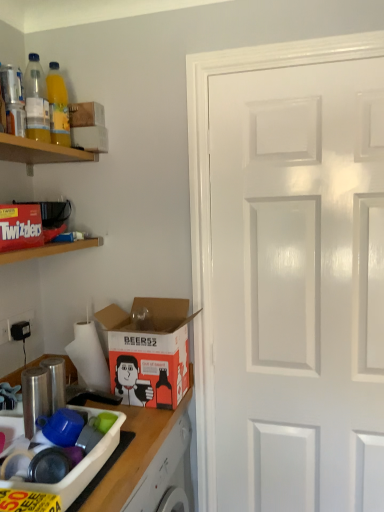
What do you see at coordinates (40, 152) in the screenshot? The width and height of the screenshot is (384, 512). I see `wooden shelf at upper left, arranged as the second shelf when ordered from the bottom` at bounding box center [40, 152].

Describe the element at coordinates (36, 101) in the screenshot. I see `translucent plastic bottle at upper left, the second bottle in the back-to-front sequence` at that location.

Where is `white matte toilet paper at lower left`? The image size is (384, 512). white matte toilet paper at lower left is located at coordinates (89, 357).

Find the location of a particular element. The height and width of the screenshot is (512, 384). white cardboard box at upper left, which is counted as the third box, starting from the front is located at coordinates (90, 138).

This screenshot has width=384, height=512. What do you see at coordinates (294, 275) in the screenshot?
I see `white glossy door at right` at bounding box center [294, 275].

Locate an element on the screen. Image resolution: width=384 pixels, height=512 pixels. translucent plastic bottle at upper left, marked as the 1th bottle in a back-to-front arrangement is located at coordinates (58, 106).

Is translucent plastic bottle at upper left, marked as the 1th bottle in a back-to-front arrangement, oriented towards translucent plastic bottle at upper left, the second bottle in the back-to-front sequence?

No, translucent plastic bottle at upper left, marked as the 1th bottle in a back-to-front arrangement, is not aimed at translucent plastic bottle at upper left, the second bottle in the back-to-front sequence.

From the image's perspective, would you say translucent plastic bottle at upper left, marked as the 2th bottle in a front-to-back arrangement, is positioned over translucent plastic bottle at upper left, positioned as the first bottle in front-to-back order?

Yes, from the image's perspective, translucent plastic bottle at upper left, marked as the 2th bottle in a front-to-back arrangement, is on top of translucent plastic bottle at upper left, positioned as the first bottle in front-to-back order.

Does translucent plastic bottle at upper left, marked as the 1th bottle in a back-to-front arrangement, lie behind translucent plastic bottle at upper left, positioned as the first bottle in front-to-back order?

Yes, translucent plastic bottle at upper left, marked as the 1th bottle in a back-to-front arrangement, is further from the viewer.

How many degrees apart are the facing directions of translucent plastic bottle at upper left, marked as the 1th bottle in a back-to-front arrangement, and translucent plastic bottle at upper left, the second bottle in the back-to-front sequence?

The angle between the facing direction of translucent plastic bottle at upper left, marked as the 1th bottle in a back-to-front arrangement, and the facing direction of translucent plastic bottle at upper left, the second bottle in the back-to-front sequence, is 0.00115 degrees.

Is translucent plastic bottle at upper left, the second bottle in the back-to-front sequence, not close to white matte toilet paper at lower left?

No.

Does translucent plastic bottle at upper left, positioned as the first bottle in front-to-back order, have a greater height compared to white matte toilet paper at lower left?

Indeed, translucent plastic bottle at upper left, positioned as the first bottle in front-to-back order, has a greater height compared to white matte toilet paper at lower left.

Which object is positioned more to the left, translucent plastic bottle at upper left, positioned as the first bottle in front-to-back order, or white matte toilet paper at lower left?

translucent plastic bottle at upper left, positioned as the first bottle in front-to-back order, is more to the left.

Who is bigger, translucent plastic bottle at upper left, positioned as the first bottle in front-to-back order, or white matte toilet paper at lower left?

white matte toilet paper at lower left is bigger.

Looking at their sizes, would you say red matte twizzlers box at upper left, marked as the second shelf in a top-to-bottom arrangement, is wider or thinner than translucent plastic bottle at upper left, positioned as the first bottle in front-to-back order?

Considering their sizes, red matte twizzlers box at upper left, marked as the second shelf in a top-to-bottom arrangement, looks broader than translucent plastic bottle at upper left, positioned as the first bottle in front-to-back order.

From a real-world perspective, is red matte twizzlers box at upper left, arranged as the first shelf when ordered from the bottom, located beneath translucent plastic bottle at upper left, the second bottle in the back-to-front sequence?

Correct, in the physical world, red matte twizzlers box at upper left, arranged as the first shelf when ordered from the bottom, is lower than translucent plastic bottle at upper left, the second bottle in the back-to-front sequence.

Consider the image. Which of these two, red matte twizzlers box at upper left, arranged as the first shelf when ordered from the bottom, or translucent plastic bottle at upper left, the second bottle in the back-to-front sequence, is bigger?

red matte twizzlers box at upper left, arranged as the first shelf when ordered from the bottom, is bigger.

Is red matte twizzlers box at upper left, arranged as the first shelf when ordered from the bottom, positioned beyond the bounds of translucent plastic bottle at upper left, the second bottle in the back-to-front sequence?

Indeed, red matte twizzlers box at upper left, arranged as the first shelf when ordered from the bottom, is completely outside translucent plastic bottle at upper left, the second bottle in the back-to-front sequence.

Does matte red twizzlers box at upper left, marked as the second box in a top-to-bottom arrangement, have a greater width compared to wooden countertop at lower left?

No, matte red twizzlers box at upper left, marked as the second box in a top-to-bottom arrangement, is not wider than wooden countertop at lower left.

Choose the correct answer: Is matte red twizzlers box at upper left, marked as the second box in a top-to-bottom arrangement, inside wooden countertop at lower left or outside it?

The correct answer is: outside.

Considering the positions of points (15, 219) and (70, 361), is point (15, 219) closer to camera compared to point (70, 361)?

Yes, it is in front of point (70, 361).

Consider the image. Is the position of matte red twizzlers box at upper left, marked as the second box in a top-to-bottom arrangement, less distant than that of wooden countertop at lower left?

That is False.

Which of these two, orange matte cardboard box at lower left or translucent plastic bottle at upper left, positioned as the first bottle in front-to-back order, is bigger?

orange matte cardboard box at lower left.

From the image's perspective, is orange matte cardboard box at lower left over translucent plastic bottle at upper left, the second bottle in the back-to-front sequence?

No, from the image's perspective, orange matte cardboard box at lower left is not over translucent plastic bottle at upper left, the second bottle in the back-to-front sequence.

Where is `cardboard box on the right of translucent plastic bottle at upper left, the second bottle in the back-to-front sequence`? cardboard box on the right of translucent plastic bottle at upper left, the second bottle in the back-to-front sequence is located at coordinates (149, 351).

Considering the positions of objects orange matte cardboard box at lower left and translucent plastic bottle at upper left, positioned as the first bottle in front-to-back order, in the image provided, who is more to the left, orange matte cardboard box at lower left or translucent plastic bottle at upper left, positioned as the first bottle in front-to-back order,?

translucent plastic bottle at upper left, positioned as the first bottle in front-to-back order, is more to the left.

Is wooden shelf at upper left, arranged as the second shelf when ordered from the bottom, located outside matte cardboard box at lower left, the third box viewed from the top?

Yes, wooden shelf at upper left, arranged as the second shelf when ordered from the bottom, is located beyond the bounds of matte cardboard box at lower left, the third box viewed from the top.

Is point (23, 155) closer or farther from the camera than point (111, 434)?

Point (23, 155) is positioned farther from the camera compared to point (111, 434).

From a real-world perspective, is wooden shelf at upper left, the first shelf when ordered from top to bottom, physically located above or below matte cardboard box at lower left, which ranks as the first box in bottom-to-top order?

wooden shelf at upper left, the first shelf when ordered from top to bottom, is situated higher than matte cardboard box at lower left, which ranks as the first box in bottom-to-top order, in the real world.

Visually, is wooden shelf at upper left, arranged as the second shelf when ordered from the bottom, positioned to the left or to the right of matte cardboard box at lower left, which is the first box from front to back?

wooden shelf at upper left, arranged as the second shelf when ordered from the bottom, is positioned on matte cardboard box at lower left, which is the first box from front to back,'s left side.

Considering the positions of objects translucent plastic bottle at upper left, marked as the 2th bottle in a front-to-back arrangement, and wooden shelf at upper left, arranged as the second shelf when ordered from the bottom, in the image provided, who is behind, translucent plastic bottle at upper left, marked as the 2th bottle in a front-to-back arrangement, or wooden shelf at upper left, arranged as the second shelf when ordered from the bottom,?

translucent plastic bottle at upper left, marked as the 2th bottle in a front-to-back arrangement, is more distant.

Considering the sizes of translucent plastic bottle at upper left, marked as the 1th bottle in a back-to-front arrangement, and wooden shelf at upper left, the first shelf when ordered from top to bottom, in the image, is translucent plastic bottle at upper left, marked as the 1th bottle in a back-to-front arrangement, wider or thinner than wooden shelf at upper left, the first shelf when ordered from top to bottom,?

translucent plastic bottle at upper left, marked as the 1th bottle in a back-to-front arrangement, is thinner than wooden shelf at upper left, the first shelf when ordered from top to bottom.

From a real-world perspective, does translucent plastic bottle at upper left, marked as the 1th bottle in a back-to-front arrangement, stand above wooden shelf at upper left, the first shelf when ordered from top to bottom?

Indeed, from a real-world perspective, translucent plastic bottle at upper left, marked as the 1th bottle in a back-to-front arrangement, stands above wooden shelf at upper left, the first shelf when ordered from top to bottom.

Locate an element on the screen. The width and height of the screenshot is (384, 512). bottle located behind the translucent plastic bottle at upper left, positioned as the first bottle in front-to-back order is located at coordinates (58, 106).

The image size is (384, 512). What are the coordinates of `toilet paper below the translucent plastic bottle at upper left, positioned as the first bottle in front-to-back order (from the image's perspective)` in the screenshot? It's located at (89, 357).

Looking at the image, which one is located closer to matte red twizzlers box at upper left, marked as the second box in a back-to-front arrangement, translucent plastic bottle at upper left, marked as the 2th bottle in a front-to-back arrangement, or white cardboard box at upper left, which is counted as the third box, starting from the front?

The object closer to matte red twizzlers box at upper left, marked as the second box in a back-to-front arrangement, is translucent plastic bottle at upper left, marked as the 2th bottle in a front-to-back arrangement.

From the image, which object appears to be farther from matte cardboard box at lower left, which is the 3th box from back to front, wooden countertop at lower left or wooden shelf at upper left, arranged as the second shelf when ordered from the bottom?

wooden shelf at upper left, arranged as the second shelf when ordered from the bottom.

Based on their spatial positions, is wooden shelf at upper left, the first shelf when ordered from top to bottom, or translucent plastic bottle at upper left, marked as the 2th bottle in a front-to-back arrangement, further from translucent plastic bottle at upper left, the second bottle in the back-to-front sequence?

Among the two, wooden shelf at upper left, the first shelf when ordered from top to bottom, is located further to translucent plastic bottle at upper left, the second bottle in the back-to-front sequence.

Which object lies nearer to the anchor point matte red twizzlers box at upper left, acting as the second box starting from the front, white cardboard box at upper left, which appears as the first box when viewed from the top, or matte cardboard box at lower left, which is the 3th box from back to front?

white cardboard box at upper left, which appears as the first box when viewed from the top, lies closer to matte red twizzlers box at upper left, acting as the second box starting from the front, than the other object.

In the scene shown: Estimate the real-world distances between objects in this image. Which object is closer to matte cardboard box at lower left, which is the first box from front to back, matte red twizzlers box at upper left, placed as the second box when sorted from bottom to top, or white glossy door at right?

matte red twizzlers box at upper left, placed as the second box when sorted from bottom to top, is closer to matte cardboard box at lower left, which is the first box from front to back.

Based on their spatial positions, is matte cardboard box at lower left, which is the first box from front to back, or translucent plastic bottle at upper left, the second bottle in the back-to-front sequence, further from wooden shelf at upper left, the first shelf when ordered from top to bottom?

matte cardboard box at lower left, which is the first box from front to back, is positioned further to the anchor wooden shelf at upper left, the first shelf when ordered from top to bottom.

Which object lies nearer to the anchor point matte cardboard box at lower left, which ranks as the first box in bottom-to-top order, translucent plastic bottle at upper left, marked as the 2th bottle in a front-to-back arrangement, or white matte toilet paper at lower left?

Based on the image, white matte toilet paper at lower left appears to be nearer to matte cardboard box at lower left, which ranks as the first box in bottom-to-top order.

Estimate the real-world distances between objects in this image. Which object is closer to wooden countertop at lower left, white matte toilet paper at lower left or wooden shelf at upper left, arranged as the second shelf when ordered from the bottom?

Based on the image, white matte toilet paper at lower left appears to be nearer to wooden countertop at lower left.

The image size is (384, 512). Identify the location of shelf between translucent plastic bottle at upper left, marked as the 1th bottle in a back-to-front arrangement, and red matte twizzlers box at upper left, marked as the second shelf in a top-to-bottom arrangement, from top to bottom. (40, 152).

Image resolution: width=384 pixels, height=512 pixels. I want to click on box between red matte twizzlers box at upper left, arranged as the first shelf when ordered from the bottom, and white cardboard box at upper left, which ranks as the first box in back-to-front order, from front to back, so click(x=20, y=226).

Where is `toilet paper situated between matte red twizzlers box at upper left, marked as the second box in a top-to-bottom arrangement, and white glossy door at right from left to right`? This screenshot has width=384, height=512. toilet paper situated between matte red twizzlers box at upper left, marked as the second box in a top-to-bottom arrangement, and white glossy door at right from left to right is located at coordinates (89, 357).

Where is `door between white cardboard box at upper left, which is counted as the third box, starting from the front, and wooden countertop at lower left vertically`? door between white cardboard box at upper left, which is counted as the third box, starting from the front, and wooden countertop at lower left vertically is located at coordinates (294, 275).